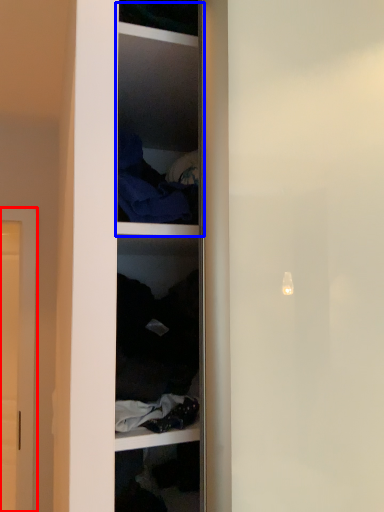
Question: Which of the following is the closest to the observer, door (highlighted by a red box) or cabinet (highlighted by a blue box)?

Choices:
 (A) door
 (B) cabinet

Answer: (B)